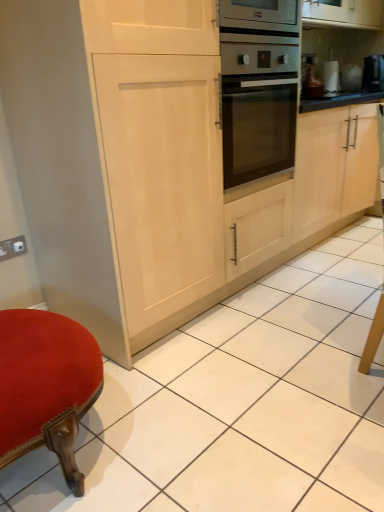
Question: Does point (8, 250) appear closer or farther from the camera than point (377, 53)?

Choices:
 (A) farther
 (B) closer

Answer: (B)

Question: Looking at the image, does matte white electric outlet at lower left seem bigger or smaller compared to black glossy coffee maker at upper right?

Choices:
 (A) big
 (B) small

Answer: (B)

Question: Considering their positions, is matte white electric outlet at lower left located in front of or behind black glossy coffee maker at upper right?

Choices:
 (A) front
 (B) behind

Answer: (A)

Question: From the image's perspective, is black glossy coffee maker at upper right above or below matte white electric outlet at lower left?

Choices:
 (A) below
 (B) above

Answer: (B)

Question: Is point (362, 82) closer or farther from the camera than point (3, 245)?

Choices:
 (A) closer
 (B) farther

Answer: (B)

Question: From a real-world perspective, is black glossy coffee maker at upper right positioned above or below matte white electric outlet at lower left?

Choices:
 (A) below
 (B) above

Answer: (B)

Question: Would you say black glossy coffee maker at upper right is to the left or to the right of matte white electric outlet at lower left in the picture?

Choices:
 (A) left
 (B) right

Answer: (B)